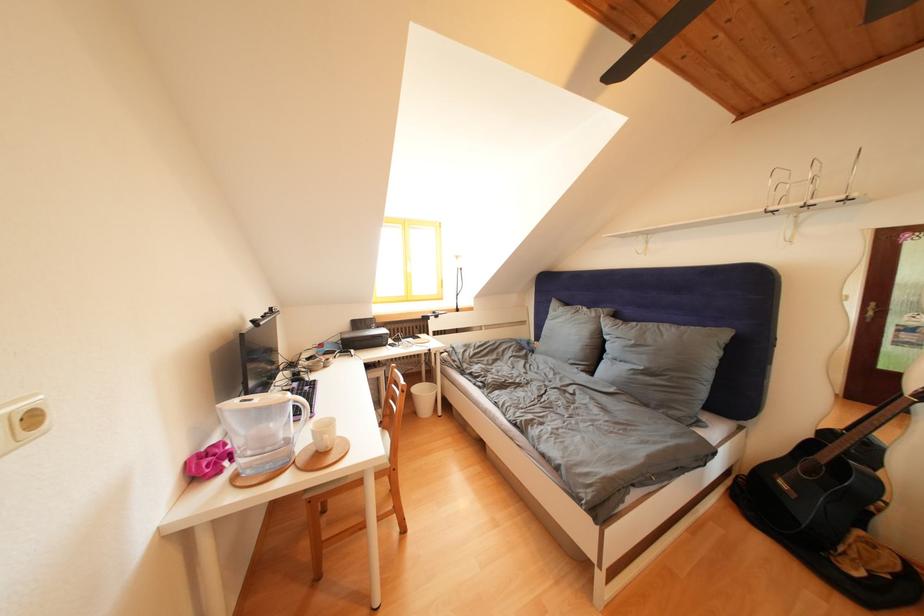
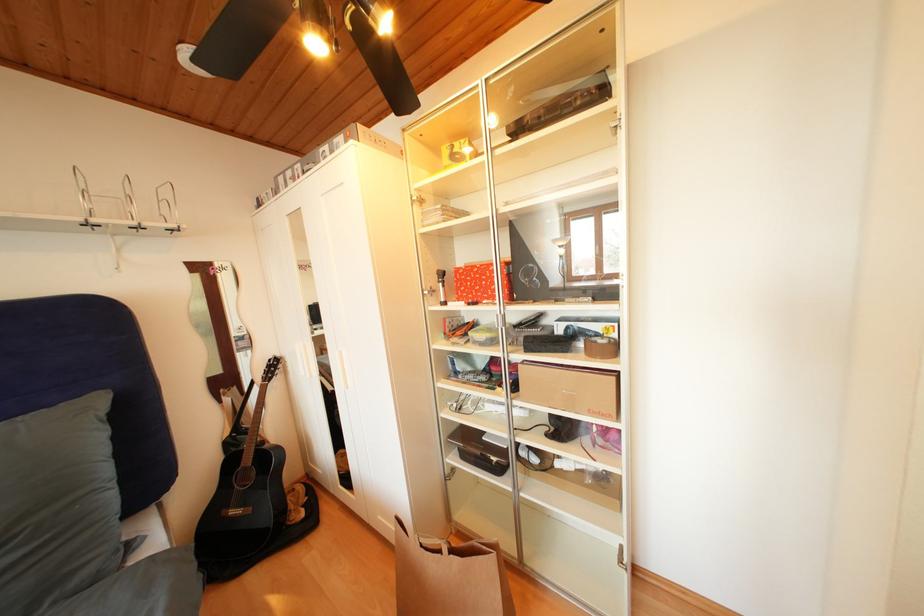
Question: The camera is either moving clockwise (left) or counter-clockwise (right) around the object. The first image is from the beginning of the video and the second image is from the end. Is the camera moving left or right when shooting the video?

Choices:
 (A) Left
 (B) Right

Answer: (A)